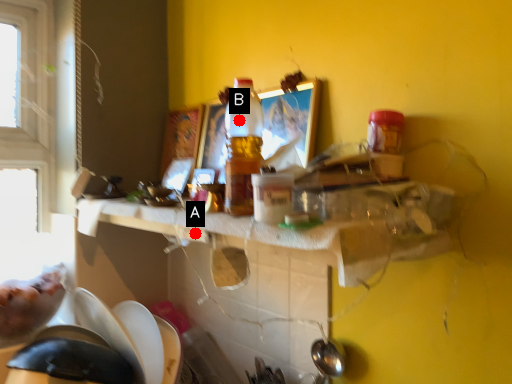
Question: Two points are circled on the image, labeled by A and B beside each circle. Which of the following is the farthest from the observer?

Choices:
 (A) A is further
 (B) B is further

Answer: (A)